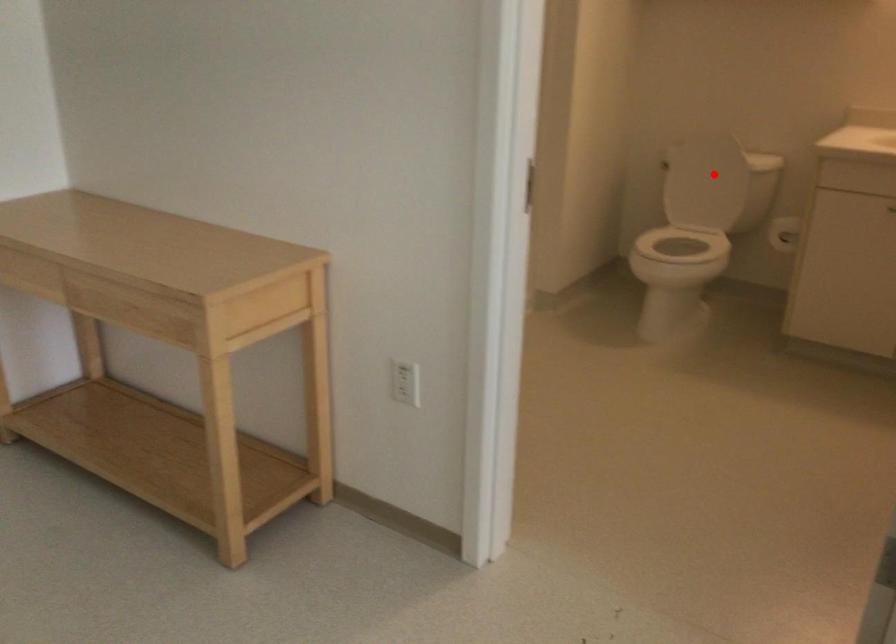
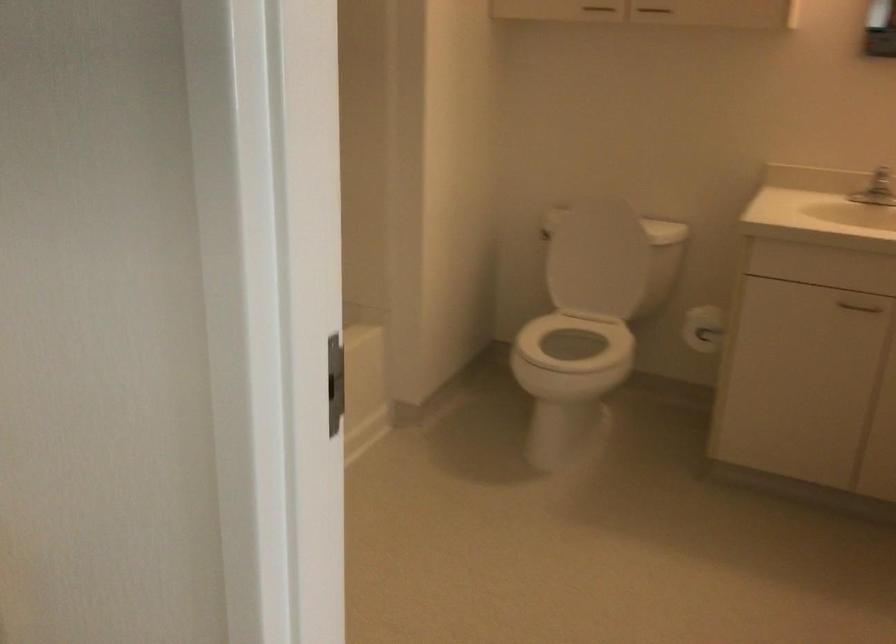
The point at the highlighted location is marked in the first image. Where is the corresponding point in the second image?

(596, 258)